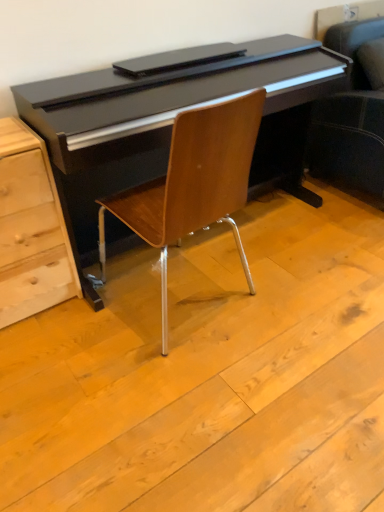
Question: From a real-world perspective, does woodenchair at center stand above light wood chest of drawers at lower left?

Choices:
 (A) yes
 (B) no

Answer: (A)

Question: Does woodenchair at center have a larger size compared to light wood chest of drawers at lower left?

Choices:
 (A) yes
 (B) no

Answer: (A)

Question: Would you consider woodenchair at center to be distant from light wood chest of drawers at lower left?

Choices:
 (A) yes
 (B) no

Answer: (B)

Question: Does woodenchair at center lie behind light wood chest of drawers at lower left?

Choices:
 (A) no
 (B) yes

Answer: (A)

Question: Does woodenchair at center have a greater width compared to light wood chest of drawers at lower left?

Choices:
 (A) no
 (B) yes

Answer: (B)

Question: From the image's perspective, does woodenchair at center appear lower than light wood chest of drawers at lower left?

Choices:
 (A) yes
 (B) no

Answer: (B)

Question: Is light wood chest of drawers at lower left aimed at woodenchair at center?

Choices:
 (A) no
 (B) yes

Answer: (A)

Question: Is light wood chest of drawers at lower left at the left side of woodenchair at center?

Choices:
 (A) yes
 (B) no

Answer: (A)

Question: Can you confirm if light wood chest of drawers at lower left is positioned to the right of woodenchair at center?

Choices:
 (A) no
 (B) yes

Answer: (A)

Question: From the image's perspective, would you say light wood chest of drawers at lower left is shown under woodenchair at center?

Choices:
 (A) yes
 (B) no

Answer: (A)

Question: Is light wood chest of drawers at lower left taller than woodenchair at center?

Choices:
 (A) yes
 (B) no

Answer: (B)

Question: Considering the relative sizes of light wood chest of drawers at lower left and woodenchair at center in the image provided, is light wood chest of drawers at lower left thinner than woodenchair at center?

Choices:
 (A) no
 (B) yes

Answer: (B)

Question: Considering the positions of light wood chest of drawers at lower left and woodenchair at center in the image, is light wood chest of drawers at lower left wider or thinner than woodenchair at center?

Choices:
 (A) wide
 (B) thin

Answer: (B)